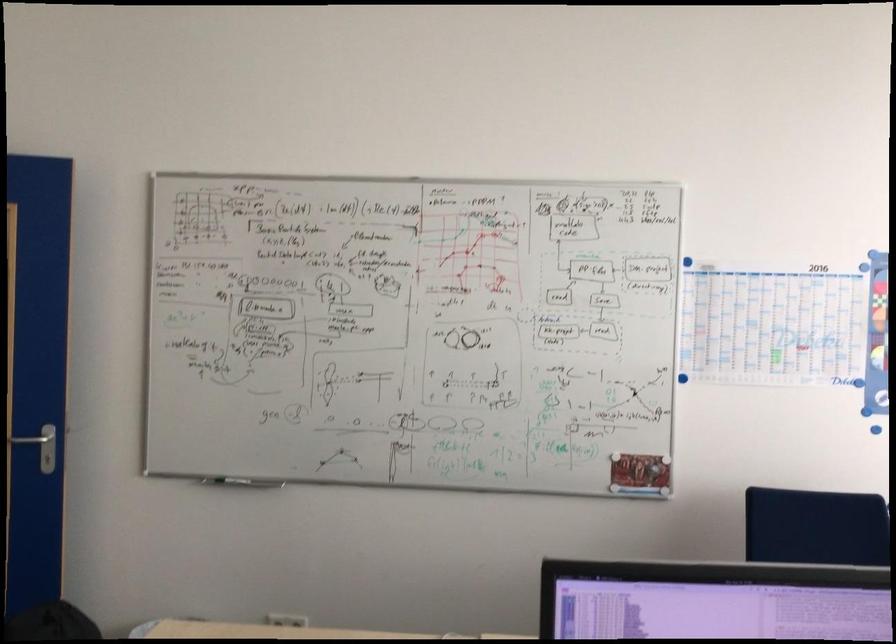
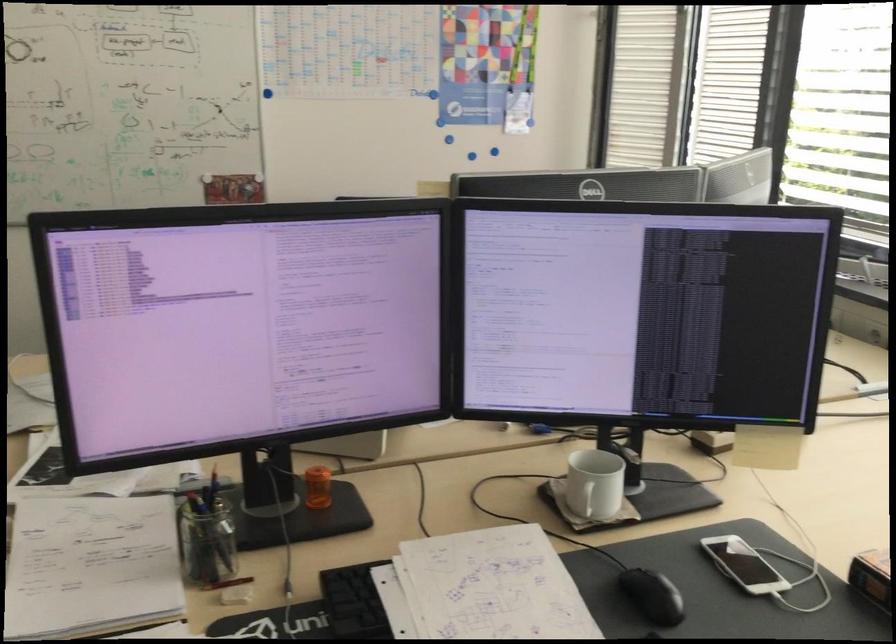
The point at (678,374) is marked in the first image. Where is the corresponding point in the second image?

(266, 93)